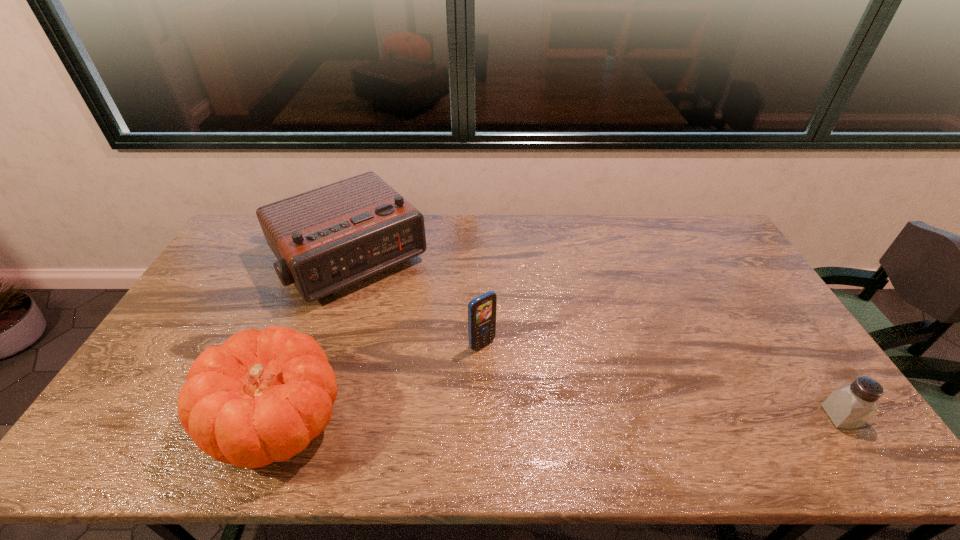
Locate an element on the screen. This screenshot has height=540, width=960. pumpkin is located at coordinates (262, 397).

This screenshot has width=960, height=540. I want to click on saltshaker, so click(850, 406).

Locate an element on the screen. This screenshot has width=960, height=540. the rightmost object is located at coordinates (850, 406).

Where is `cellular telephone`? cellular telephone is located at coordinates (481, 310).

Find the location of a particular element. the third nearest object is located at coordinates 481,310.

I want to click on radio receiver, so click(326, 239).

Locate an element on the screen. This screenshot has height=540, width=960. free region located 0.390m on the back of the pumpkin is located at coordinates (334, 272).

In order to click on vacant point located on the left of the saltshaker in this screenshot , I will do `click(767, 416)`.

Identify the location of free region located on the screen of the cellular telephone. (x=515, y=378).

At what (x,y) coordinates should I click in order to perform the action: click on vacant space located 0.190m on the screen of the cellular telephone. Please return your answer as a coordinate pair (x, y). This screenshot has height=540, width=960. Looking at the image, I should click on (535, 399).